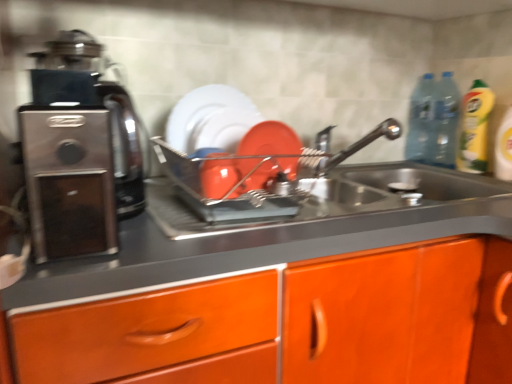
Question: From the image's perspective, is matte orange plate at center positioned above or below transparent plastic bottle at upper right, which ranks as the first bottle in left-to-right order?

Choices:
 (A) below
 (B) above

Answer: (A)

Question: Relative to transparent plastic bottle at upper right, which is the 2th bottle in right-to-left order, is matte orange plate at center in front or behind?

Choices:
 (A) front
 (B) behind

Answer: (A)

Question: Which object is the farthest from the matte orange plate at center?

Choices:
 (A) satin nickel faucet at upper center
 (B) shiny metallic dish rack at center
 (C) yellow liquid bottle at right
 (D) satin black coffee machine at left
 (E) transparent plastic bottle at upper right, which is the 2th bottle in right-to-left order

Answer: (E)

Question: Estimate the real-world distances between objects in this image. Which object is closer to the shiny metallic dish rack at center?

Choices:
 (A) satin metallic sink at center
 (B) transparent plastic bottle at upper right, which is counted as the second bottle, starting from the left
 (C) matte orange plate at center
 (D) satin nickel faucet at upper center
 (E) satin black coffee machine at left

Answer: (C)